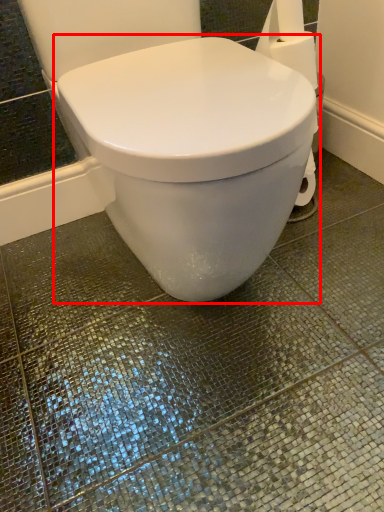
Question: Considering the relative positions of toilet (annotated by the red box) and toilet paper in the image provided, where is toilet (annotated by the red box) located with respect to the staircase?

Choices:
 (A) right
 (B) left

Answer: (B)